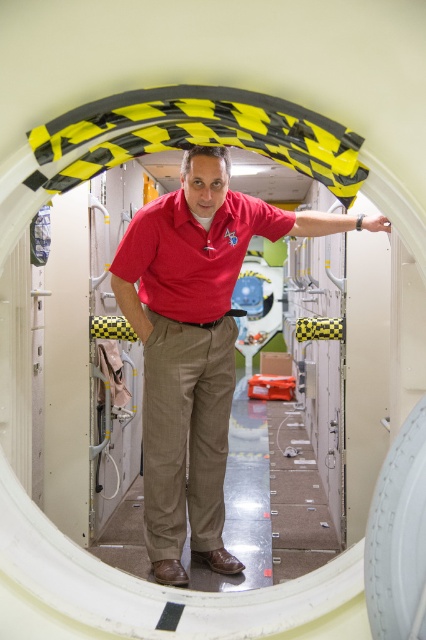
You are a flight attendant checking the safety equipment in the aircraft. You need to reach a first aid kit located 10 centimeters away from your current position. If the distance between the matte red shirt at center and the khaki fabric trousers at center is 9.81 centimeters, can you comfortably reach the first aid kit without moving your feet?

The distance between the matte red shirt at center and the khaki fabric trousers at center is 9.81 centimeters, which is slightly less than 10 centimeters. Since the first aid kit is only 10 centimeters away, you can comfortably reach it without moving your feet as the existing distance between the shirt and trousers suggests the space is manageable.